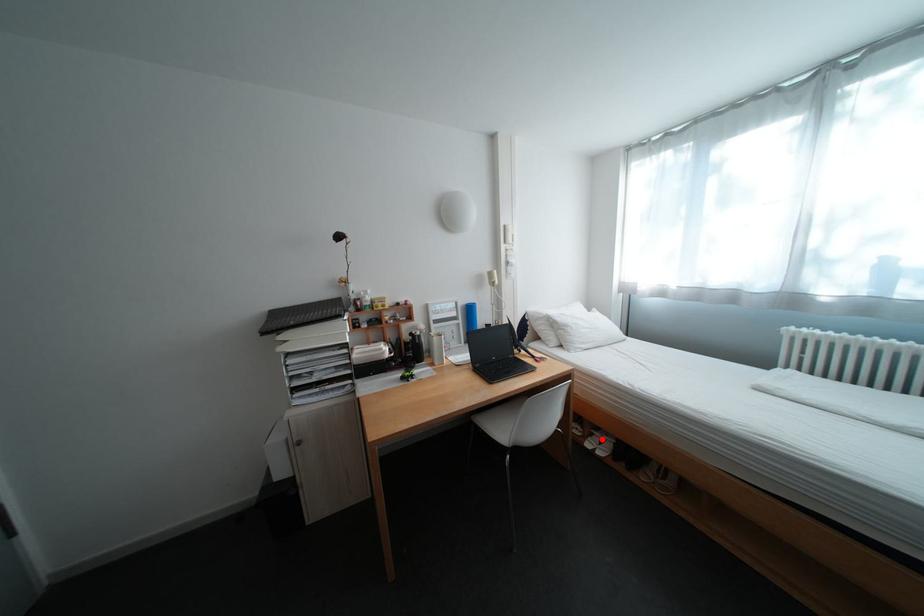
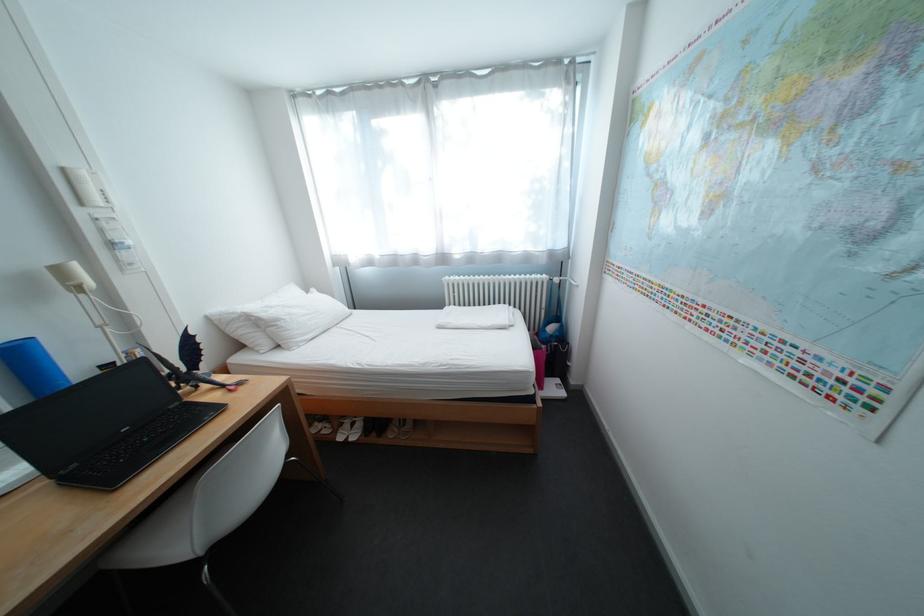
Question: I am providing you with two images of the same scene from different viewpoints. Image1 has a red point marked. In image2, the corresponding 3D location appears at what relative position? Reply with the corresponding letter.

Choices:
 (A) Closer
 (B) Farther

Answer: (B)